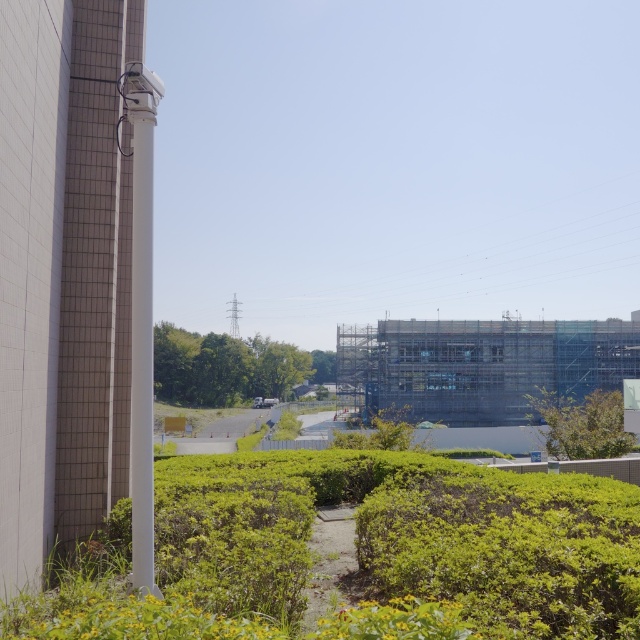
Who is taller, green leafy bush at center or green leafy shrubs at center?

With more height is green leafy shrubs at center.

Is green leafy bush at center closer to camera compared to green leafy shrubs at center?

That is True.

Between point (472, 522) and point (278, 392), which one is positioned in front?

Point (472, 522) is in front.

The width and height of the screenshot is (640, 640). I want to click on green leafy bush at center, so click(x=508, y=547).